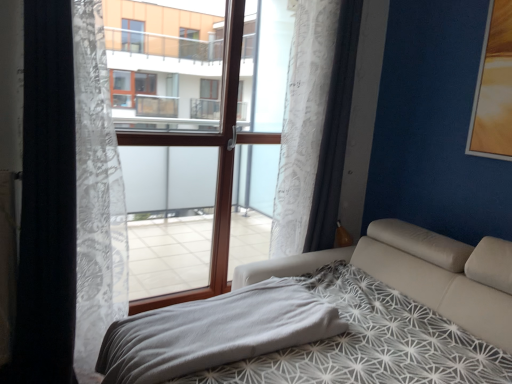
Question: Is gray soft blanket at lower center at the right side of white sheer curtain at left, which ranks as the 1th curtain in left-to-right order?

Choices:
 (A) yes
 (B) no

Answer: (A)

Question: Does gray soft blanket at lower center have a smaller size compared to white sheer curtain at left, which ranks as the 3th curtain in right-to-left order?

Choices:
 (A) yes
 (B) no

Answer: (B)

Question: Considering the relative positions of gray soft blanket at lower center and white sheer curtain at left, which ranks as the 3th curtain in right-to-left order, in the image provided, is gray soft blanket at lower center behind white sheer curtain at left, which ranks as the 3th curtain in right-to-left order,?

Choices:
 (A) no
 (B) yes

Answer: (A)

Question: Is gray soft blanket at lower center turned away from white sheer curtain at left, which ranks as the 3th curtain in right-to-left order?

Choices:
 (A) yes
 (B) no

Answer: (B)

Question: Does gray soft blanket at lower center have a lesser height compared to white sheer curtain at left, which ranks as the 1th curtain in left-to-right order?

Choices:
 (A) yes
 (B) no

Answer: (A)

Question: Is brown wood window frame at center wider or thinner than white sheer curtain at left, which ranks as the 1th curtain in left-to-right order?

Choices:
 (A) wide
 (B) thin

Answer: (B)

Question: From the image's perspective, relative to white sheer curtain at left, which ranks as the 1th curtain in left-to-right order, is brown wood window frame at center above or below?

Choices:
 (A) below
 (B) above

Answer: (B)

Question: Is brown wood window frame at center inside or outside of white sheer curtain at left, which ranks as the 3th curtain in right-to-left order?

Choices:
 (A) outside
 (B) inside

Answer: (A)

Question: In the image, is brown wood window frame at center on the left side or the right side of white sheer curtain at left, which ranks as the 3th curtain in right-to-left order?

Choices:
 (A) right
 (B) left

Answer: (A)

Question: Considering the positions of gray soft blanket at lower center and brown wood window frame at center in the image, is gray soft blanket at lower center taller or shorter than brown wood window frame at center?

Choices:
 (A) short
 (B) tall

Answer: (A)

Question: Relative to brown wood window frame at center, is gray soft blanket at lower center in front or behind?

Choices:
 (A) behind
 (B) front

Answer: (B)

Question: Is gray soft blanket at lower center inside the boundaries of brown wood window frame at center, or outside?

Choices:
 (A) outside
 (B) inside

Answer: (A)

Question: Would you say gray soft blanket at lower center is to the left or to the right of brown wood window frame at center in the picture?

Choices:
 (A) right
 (B) left

Answer: (A)

Question: Based on their positions, is gray soft blanket at lower center located to the left or right of white sheer curtain at left, which ranks as the 1th curtain in left-to-right order?

Choices:
 (A) left
 (B) right

Answer: (B)

Question: Is point click(279, 347) closer or farther from the camera than point click(20, 296)?

Choices:
 (A) farther
 (B) closer

Answer: (B)